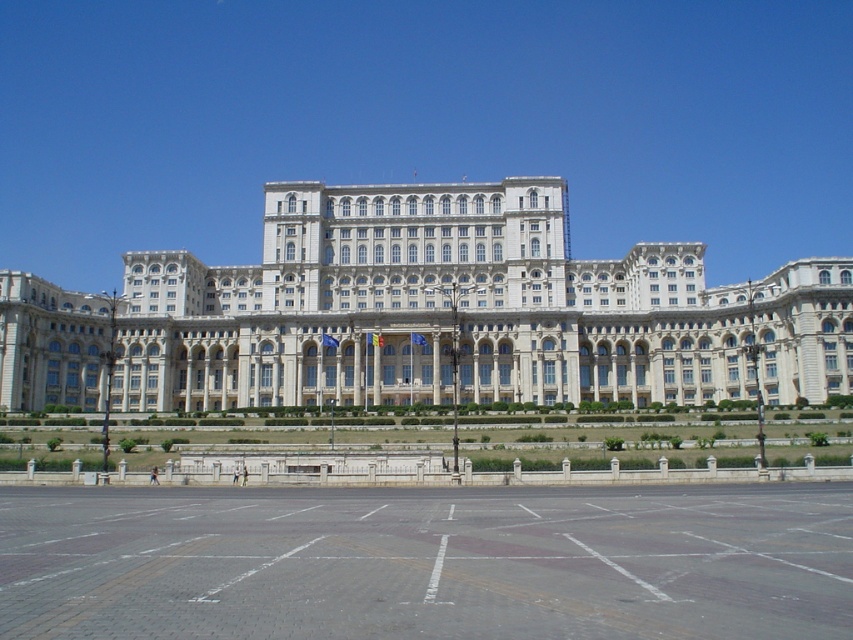
Question: Which object is farther from the camera taking this photo?

Choices:
 (A) gray brick plaza at lower center
 (B) white stone building at center

Answer: (B)

Question: Does white stone building at center appear on the left side of gray brick plaza at lower center?

Choices:
 (A) yes
 (B) no

Answer: (B)

Question: Which point is closer to the camera taking this photo?

Choices:
 (A) (440, 400)
 (B) (836, 516)

Answer: (B)

Question: Which point is closer to the camera taking this photo?

Choices:
 (A) (448, 508)
 (B) (225, 321)

Answer: (A)

Question: Can you confirm if white stone building at center is positioned to the left of gray brick plaza at lower center?

Choices:
 (A) yes
 (B) no

Answer: (B)

Question: Is white stone building at center in front of gray brick plaza at lower center?

Choices:
 (A) yes
 (B) no

Answer: (B)